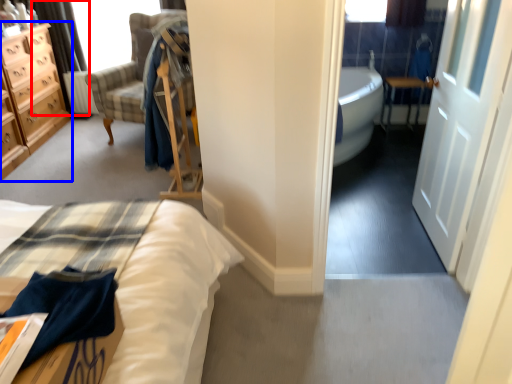
Question: Which point is closer to the camera, curtain (highlighted by a red box) or chest of drawers (highlighted by a blue box)?

Choices:
 (A) curtain
 (B) chest of drawers

Answer: (B)